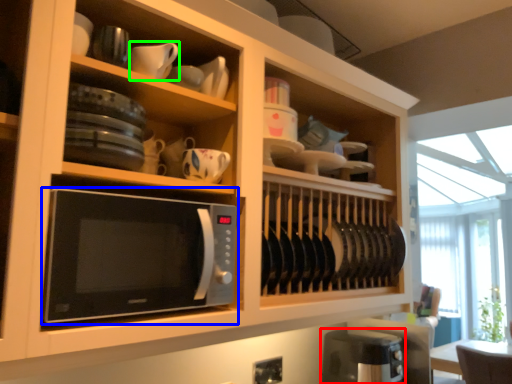
Question: Estimate the real-world distances between objects in this image. Which object is farther from appliance (highlighted by a red box), microwave oven (highlighted by a blue box) or tableware (highlighted by a green box)?

Choices:
 (A) microwave oven
 (B) tableware

Answer: (B)